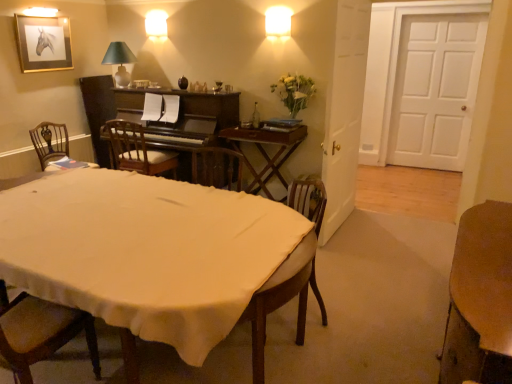
Question: Considering the positions of wooden desk at center, marked as the first table in a top-to-bottom arrangement, and transparent glass bottle at center in the image, is wooden desk at center, marked as the first table in a top-to-bottom arrangement, taller or shorter than transparent glass bottle at center?

Choices:
 (A) short
 (B) tall

Answer: (B)

Question: From the image's perspective, relative to transparent glass bottle at center, is wooden desk at center, marked as the first table in a top-to-bottom arrangement, above or below?

Choices:
 (A) above
 (B) below

Answer: (B)

Question: Based on their relative distances, which object is farther from the transparent glass bottle at center?

Choices:
 (A) gold-framed picture at upper left
 (B) transparent glass wine glass at upper center
 (C) wooden chair at center, arranged as the 3th chair when viewed from the front
 (D) wooden chair at left, which is counted as the second chair, starting from the back
 (E) wooden chair at lower left, the third chair from the back

Answer: (E)

Question: Which object is the closest to the transparent glass bottle at center?

Choices:
 (A) wooden chair at lower left, the third chair from the back
 (B) wooden table at lower right, the 1th table positioned from the right
 (C) wooden chair at left, positioned as the 2th chair in front-to-back order
 (D) white matte vase at upper center
 (E) transparent glass wine glass at upper center

Answer: (E)